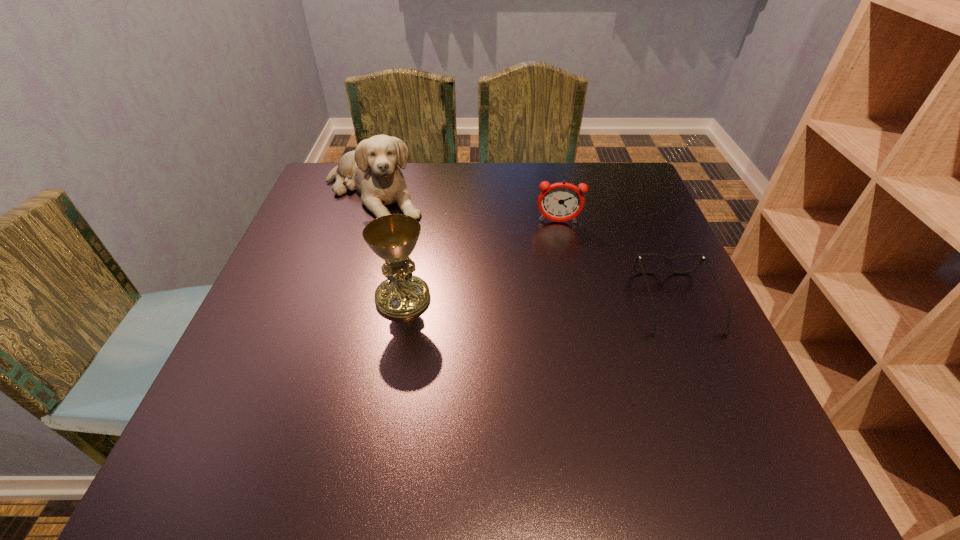
Select which object appears as the closest to the chalice. Please provide its 2D coordinates. Your answer should be formatted as a tuple, i.e. [(x, y)], where the tuple contains the x and y coordinates of a point satisfying the conditions above.

[(373, 168)]

Identify which object is the closest to the chalice. Please provide its 2D coordinates. Your answer should be formatted as a tuple, i.e. [(x, y)], where the tuple contains the x and y coordinates of a point satisfying the conditions above.

[(373, 168)]